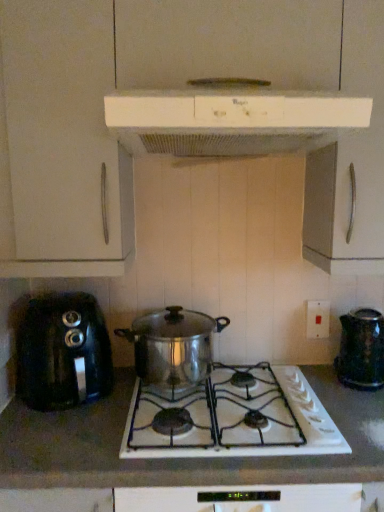
Find the location of a particular element. The width and height of the screenshot is (384, 512). white glossy gas stove at center is located at coordinates (232, 418).

You are a GUI agent. You are given a task and a screenshot of the screen. Output one action in this format:
    pyautogui.click(x=<x>, y=<y>)
    Task: Click on the white plastic range hood at upper center, which appears as the third kitchen appliance when viewed from the left
    
    Given the screenshot: What is the action you would take?
    pyautogui.click(x=233, y=120)

This screenshot has height=512, width=384. What do you see at coordinates (63, 352) in the screenshot?
I see `black plastic toaster at left, the second kitchen appliance positioned from the bottom` at bounding box center [63, 352].

What do you see at coordinates (361, 349) in the screenshot? The height and width of the screenshot is (512, 384). I see `shiny metallic kettle at right, acting as the 1th kitchen appliance starting from the right` at bounding box center [361, 349].

The image size is (384, 512). What are the coordinates of `white plastic electric outlet at right` in the screenshot? It's located at (317, 319).

Considering their positions, is shiny metallic pot at center, the 2th kitchen appliance when ordered from left to right, located in front of or behind white glossy gas stove at center?

In the image, shiny metallic pot at center, the 2th kitchen appliance when ordered from left to right, appears behind white glossy gas stove at center.

Considering the relative sizes of shiny metallic pot at center, marked as the second kitchen appliance in a top-to-bottom arrangement, and white glossy gas stove at center in the image provided, is shiny metallic pot at center, marked as the second kitchen appliance in a top-to-bottom arrangement, smaller than white glossy gas stove at center?

Actually, shiny metallic pot at center, marked as the second kitchen appliance in a top-to-bottom arrangement, might be larger than white glossy gas stove at center.

Is point (141, 361) positioned behind point (276, 389)?

That is True.

From the image's perspective, is white plastic range hood at upper center, marked as the second kitchen appliance in a right-to-left arrangement, on white ceramic stove at center?

Yes, from the image's perspective, white plastic range hood at upper center, marked as the second kitchen appliance in a right-to-left arrangement, is above white ceramic stove at center.

Is white ceramic stove at center a part of white plastic range hood at upper center, which appears as the third kitchen appliance when viewed from the left?

No.

Considering the sizes of objects white plastic range hood at upper center, the 4th kitchen appliance ordered from the bottom, and white ceramic stove at center in the image provided, who is taller, white plastic range hood at upper center, the 4th kitchen appliance ordered from the bottom, or white ceramic stove at center?

Standing taller between the two is white ceramic stove at center.

Considering the sizes of white plastic electric outlet at right and shiny metallic pot at center, the 2th kitchen appliance when ordered from left to right, in the image, is white plastic electric outlet at right bigger or smaller than shiny metallic pot at center, the 2th kitchen appliance when ordered from left to right,?

Considering their sizes, white plastic electric outlet at right takes up less space than shiny metallic pot at center, the 2th kitchen appliance when ordered from left to right.

Does white plastic electric outlet at right contain shiny metallic pot at center, which ranks as the 3th kitchen appliance in right-to-left order?

No.

Looking at this image, from a real-world perspective, who is located higher, white plastic electric outlet at right or shiny metallic pot at center, which ranks as the 3th kitchen appliance in right-to-left order?

In real-world perspective, white plastic electric outlet at right is above.

Is white plastic range hood at upper center, the 4th kitchen appliance ordered from the bottom, at the back of white ceramic stove at center?

white ceramic stove at center does not have its back to white plastic range hood at upper center, the 4th kitchen appliance ordered from the bottom.

Is white ceramic stove at center bigger than white plastic range hood at upper center, marked as the second kitchen appliance in a right-to-left arrangement?

Yes, white ceramic stove at center is bigger than white plastic range hood at upper center, marked as the second kitchen appliance in a right-to-left arrangement.

Considering the relative positions of white ceramic stove at center and white plastic range hood at upper center, marked as the second kitchen appliance in a right-to-left arrangement, in the image provided, is white ceramic stove at center to the left of white plastic range hood at upper center, marked as the second kitchen appliance in a right-to-left arrangement, from the viewer's perspective?

Incorrect, white ceramic stove at center is not on the left side of white plastic range hood at upper center, marked as the second kitchen appliance in a right-to-left arrangement.

Who is bigger, white plastic range hood at upper center, marked as the second kitchen appliance in a right-to-left arrangement, or white plastic electric outlet at right?

white plastic range hood at upper center, marked as the second kitchen appliance in a right-to-left arrangement.

How far apart are white plastic range hood at upper center, arranged as the first kitchen appliance when viewed from the top, and white plastic electric outlet at right?

They are 29.59 inches apart.

Is the position of white plastic range hood at upper center, which appears as the third kitchen appliance when viewed from the left, less distant than that of white plastic electric outlet at right?

Yes, it is in front of white plastic electric outlet at right.

Is white plastic range hood at upper center, which appears as the third kitchen appliance when viewed from the left, oriented away from white plastic electric outlet at right?

That's not correct — white plastic range hood at upper center, which appears as the third kitchen appliance when viewed from the left, is not looking away from white plastic electric outlet at right.

Is white plastic range hood at upper center, marked as the second kitchen appliance in a right-to-left arrangement, facing away from black plastic toaster at left, positioned as the first kitchen appliance in left-to-right order?

Result: No, white plastic range hood at upper center, marked as the second kitchen appliance in a right-to-left arrangement,'s orientation is not away from black plastic toaster at left, positioned as the first kitchen appliance in left-to-right order.

Measure the distance between white plastic range hood at upper center, which appears as the third kitchen appliance when viewed from the left, and black plastic toaster at left, the second kitchen appliance positioned from the bottom.

white plastic range hood at upper center, which appears as the third kitchen appliance when viewed from the left, is 28.07 inches from black plastic toaster at left, the second kitchen appliance positioned from the bottom.

Who is smaller, white plastic range hood at upper center, the 4th kitchen appliance ordered from the bottom, or black plastic toaster at left, positioned as the 4th kitchen appliance in right-to-left order?

black plastic toaster at left, positioned as the 4th kitchen appliance in right-to-left order, is smaller.

Which object is further away from the camera taking this photo, white plastic range hood at upper center, which appears as the third kitchen appliance when viewed from the left, or white glossy gas stove at center?

white glossy gas stove at center is further away from the camera.

Which of these two, white plastic range hood at upper center, marked as the second kitchen appliance in a right-to-left arrangement, or white glossy gas stove at center, is thinner?

white plastic range hood at upper center, marked as the second kitchen appliance in a right-to-left arrangement.

Considering the positions of points (321, 126) and (189, 410), is point (321, 126) closer to camera compared to point (189, 410)?

That is True.

Who is taller, white plastic range hood at upper center, which appears as the third kitchen appliance when viewed from the left, or white glossy gas stove at center?

With more height is white plastic range hood at upper center, which appears as the third kitchen appliance when viewed from the left.

Identify the location of the 1st kitchen appliance counting from the left of the white glossy gas stove at center. The image size is (384, 512). (173, 345).

Where is `the 4th kitchen appliance above the white ceramic stove at center (from the image's perspective)`? Image resolution: width=384 pixels, height=512 pixels. the 4th kitchen appliance above the white ceramic stove at center (from the image's perspective) is located at coordinates (233, 120).

Estimate the real-world distances between objects in this image. Which object is closer to shiny metallic kettle at right, placed as the 4th kitchen appliance when sorted from top to bottom, white glossy gas stove at center or white plastic electric outlet at right?

white plastic electric outlet at right is closer to shiny metallic kettle at right, placed as the 4th kitchen appliance when sorted from top to bottom.

Estimate the real-world distances between objects in this image. Which object is closer to shiny metallic pot at center, arranged as the third kitchen appliance when ordered from the bottom, white plastic electric outlet at right or white plastic range hood at upper center, the 4th kitchen appliance ordered from the bottom?

white plastic electric outlet at right is closer to shiny metallic pot at center, arranged as the third kitchen appliance when ordered from the bottom.

Looking at the image, which one is located closer to white ceramic stove at center, black plastic toaster at left, positioned as the 4th kitchen appliance in right-to-left order, or white plastic range hood at upper center, arranged as the first kitchen appliance when viewed from the top?

The object closer to white ceramic stove at center is black plastic toaster at left, positioned as the 4th kitchen appliance in right-to-left order.

Estimate the real-world distances between objects in this image. Which object is further from white plastic range hood at upper center, which appears as the third kitchen appliance when viewed from the left, shiny metallic pot at center, the 2th kitchen appliance when ordered from left to right, or white plastic electric outlet at right?

Among the two, white plastic electric outlet at right is located further to white plastic range hood at upper center, which appears as the third kitchen appliance when viewed from the left.

Based on their spatial positions, is white plastic electric outlet at right or white ceramic stove at center closer to black plastic toaster at left, positioned as the first kitchen appliance in left-to-right order?

The object closer to black plastic toaster at left, positioned as the first kitchen appliance in left-to-right order, is white ceramic stove at center.

Which object lies nearer to the anchor point white glossy gas stove at center, white plastic range hood at upper center, the 4th kitchen appliance ordered from the bottom, or black plastic toaster at left, which appears as the 3th kitchen appliance when viewed from the top?

black plastic toaster at left, which appears as the 3th kitchen appliance when viewed from the top, is positioned closer to the anchor white glossy gas stove at center.

Looking at the image, which one is located further to black plastic toaster at left, positioned as the first kitchen appliance in left-to-right order, white glossy gas stove at center or shiny metallic kettle at right, acting as the 1th kitchen appliance starting from the right?

shiny metallic kettle at right, acting as the 1th kitchen appliance starting from the right.

Looking at the image, which one is located closer to black plastic toaster at left, the second kitchen appliance positioned from the bottom, white ceramic stove at center or shiny metallic kettle at right, placed as the 4th kitchen appliance when sorted from top to bottom?

white ceramic stove at center is closer to black plastic toaster at left, the second kitchen appliance positioned from the bottom.

At what (x,y) coordinates should I click in order to perform the action: click on countertop located between black plastic toaster at left, the second kitchen appliance positioned from the bottom, and shiny metallic kettle at right, the 1th kitchen appliance in the bottom-to-top sequence, in the left-right direction. Please return your answer as a coordinate pair (x, y). This screenshot has width=384, height=512. Looking at the image, I should click on click(x=179, y=459).

This screenshot has height=512, width=384. Find the location of `countertop located between black plastic toaster at left, positioned as the first kitchen appliance in left-to-right order, and white plastic electric outlet at right in the left-right direction`. countertop located between black plastic toaster at left, positioned as the first kitchen appliance in left-to-right order, and white plastic electric outlet at right in the left-right direction is located at coordinates (179, 459).

Where is `gas stove situated between black plastic toaster at left, positioned as the first kitchen appliance in left-to-right order, and white ceramic stove at center from left to right`? Image resolution: width=384 pixels, height=512 pixels. gas stove situated between black plastic toaster at left, positioned as the first kitchen appliance in left-to-right order, and white ceramic stove at center from left to right is located at coordinates (232, 418).

In order to click on kitchen appliance between black plastic toaster at left, positioned as the 4th kitchen appliance in right-to-left order, and white glossy gas stove at center from left to right in this screenshot , I will do `click(173, 345)`.